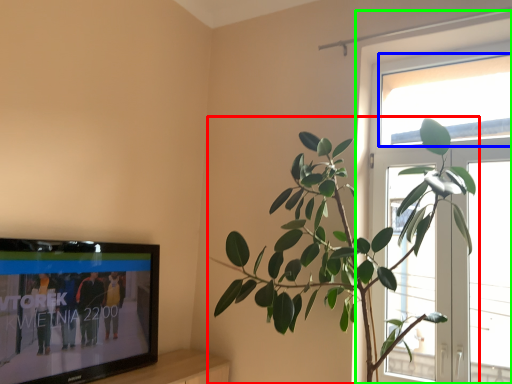
Question: Based on their relative distances, which object is farther from houseplant (highlighted by a red box)? Choose from window screen (highlighted by a blue box) and window (highlighted by a green box).

Choices:
 (A) window screen
 (B) window

Answer: (A)